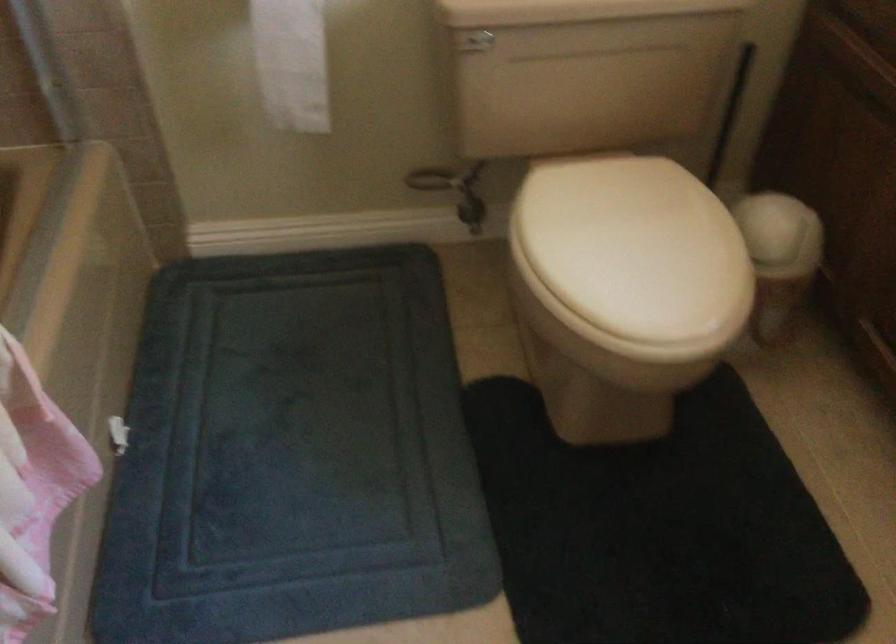
Find where to turn the water valve handle. Please return your answer as a coordinate pair (x, y).

(471, 211)